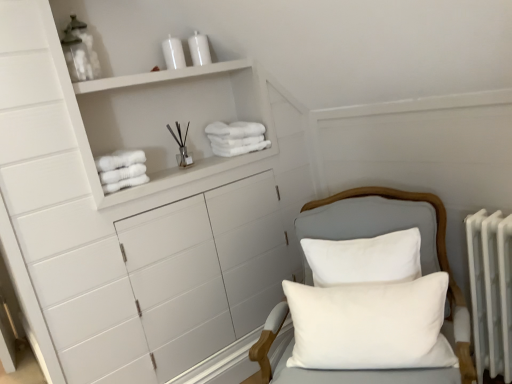
Question: Does white fluffy towels at upper left, marked as the first bath towel in a left-to-right arrangement, have a lesser height compared to white matte cabinet at upper left?

Choices:
 (A) no
 (B) yes

Answer: (B)

Question: Can you confirm if white fluffy towels at upper left, which appears as the 2th bath towel when viewed from the top, is wider than white matte cabinet at upper left?

Choices:
 (A) no
 (B) yes

Answer: (A)

Question: Is the depth of white fluffy towels at upper left, which appears as the 2th bath towel when viewed from the top, greater than that of white matte cabinet at upper left?

Choices:
 (A) yes
 (B) no

Answer: (A)

Question: From the image's perspective, does white fluffy towels at upper left, which is counted as the 2th bath towel, starting from the right, appear higher than white matte cabinet at upper left?

Choices:
 (A) no
 (B) yes

Answer: (A)

Question: Considering the relative sizes of white fluffy towels at upper left, marked as the first bath towel in a left-to-right arrangement, and white matte cabinet at upper left in the image provided, is white fluffy towels at upper left, marked as the first bath towel in a left-to-right arrangement, smaller than white matte cabinet at upper left?

Choices:
 (A) no
 (B) yes

Answer: (B)

Question: Does white fluffy towels at upper left, marked as the first bath towel in a left-to-right arrangement, turn towards white matte cabinet at upper left?

Choices:
 (A) no
 (B) yes

Answer: (B)

Question: Are white soft pillow at center, arranged as the second pillow when viewed from the top, and white soft pillow at center, placed as the 2th pillow when sorted from bottom to top, located far from each other?

Choices:
 (A) yes
 (B) no

Answer: (B)

Question: From a real-world perspective, is white soft pillow at center, which ranks as the first pillow in bottom-to-top order, on top of white soft pillow at center, marked as the first pillow in a top-to-bottom arrangement?

Choices:
 (A) yes
 (B) no

Answer: (B)

Question: Is white soft pillow at center, which ranks as the first pillow in bottom-to-top order, positioned in front of white soft pillow at center, placed as the 2th pillow when sorted from bottom to top?

Choices:
 (A) no
 (B) yes

Answer: (B)

Question: Can you confirm if white soft pillow at center, arranged as the second pillow when viewed from the top, is positioned to the right of white soft pillow at center, placed as the 2th pillow when sorted from bottom to top?

Choices:
 (A) yes
 (B) no

Answer: (B)

Question: Is white soft pillow at center, which ranks as the first pillow in bottom-to-top order, facing towards white soft pillow at center, placed as the 2th pillow when sorted from bottom to top?

Choices:
 (A) no
 (B) yes

Answer: (A)

Question: From the image's perspective, is white soft pillow at center, which ranks as the first pillow in bottom-to-top order, beneath white soft pillow at center, marked as the first pillow in a top-to-bottom arrangement?

Choices:
 (A) yes
 (B) no

Answer: (A)

Question: From the image's perspective, is white soft towel at upper center, the 2th bath towel from the left, under white matte cabinet at upper left?

Choices:
 (A) yes
 (B) no

Answer: (A)